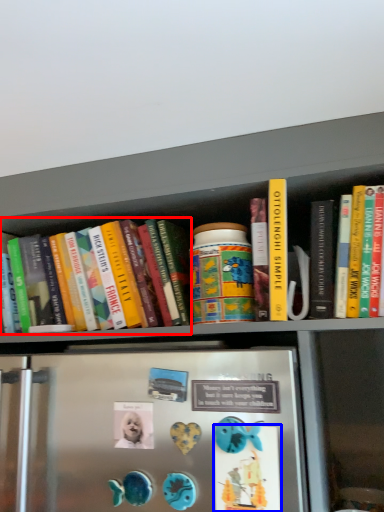
Question: Which object appears farthest to the camera in this image, book (highlighted by a red box) or button (highlighted by a blue box)?

Choices:
 (A) book
 (B) button

Answer: (A)